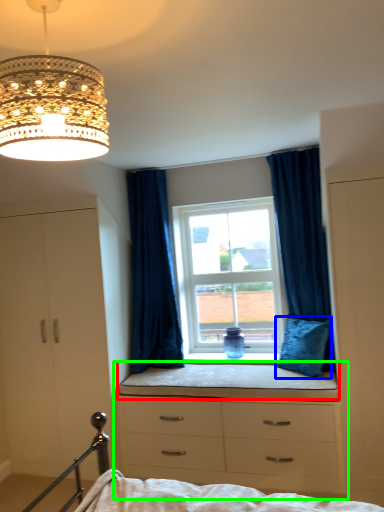
Question: Estimate the real-world distances between objects in this image. Which object is farther from window sill (highlighted by a red box), pillow (highlighted by a blue box) or chest of drawers (highlighted by a green box)?

Choices:
 (A) pillow
 (B) chest of drawers

Answer: (A)